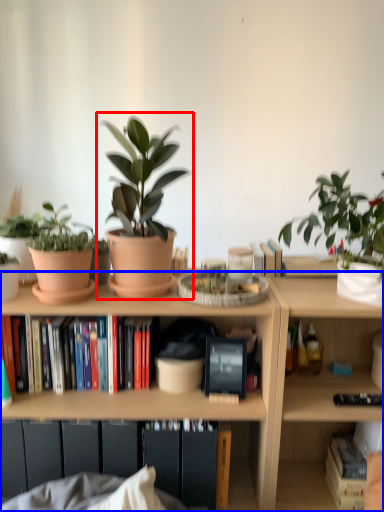
Question: Which point is further to the camera, houseplant (highlighted by a red box) or bookcase (highlighted by a blue box)?

Choices:
 (A) houseplant
 (B) bookcase

Answer: (B)